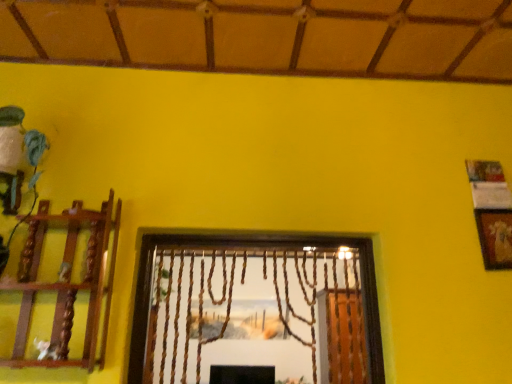
Question: From a real-world perspective, is wooden at left on gold textured picture frame at upper right?

Choices:
 (A) no
 (B) yes

Answer: (A)

Question: Considering the relative sizes of wooden at left and gold textured picture frame at upper right in the image provided, is wooden at left shorter than gold textured picture frame at upper right?

Choices:
 (A) yes
 (B) no

Answer: (B)

Question: Are wooden at left and gold textured picture frame at upper right located far from each other?

Choices:
 (A) yes
 (B) no

Answer: (A)

Question: Is the position of wooden at left more distant than that of gold textured picture frame at upper right?

Choices:
 (A) no
 (B) yes

Answer: (A)

Question: Is wooden at left aimed at gold textured picture frame at upper right?

Choices:
 (A) no
 (B) yes

Answer: (A)

Question: Does wooden at left appear on the right side of gold textured picture frame at upper right?

Choices:
 (A) yes
 (B) no

Answer: (B)

Question: Does gold textured picture frame at upper right have a lesser height compared to wooden at left?

Choices:
 (A) yes
 (B) no

Answer: (A)

Question: Is gold textured picture frame at upper right next to wooden at left?

Choices:
 (A) yes
 (B) no

Answer: (B)

Question: Is gold textured picture frame at upper right smaller than wooden at left?

Choices:
 (A) yes
 (B) no

Answer: (A)

Question: From the image's perspective, would you say gold textured picture frame at upper right is positioned over wooden at left?

Choices:
 (A) yes
 (B) no

Answer: (A)

Question: Is the position of gold textured picture frame at upper right more distant than that of wooden at left?

Choices:
 (A) yes
 (B) no

Answer: (A)

Question: Is gold textured picture frame at upper right far from wooden at left?

Choices:
 (A) no
 (B) yes

Answer: (B)

Question: Is point (505, 213) positioned closer to the camera than point (67, 253)?

Choices:
 (A) closer
 (B) farther

Answer: (B)